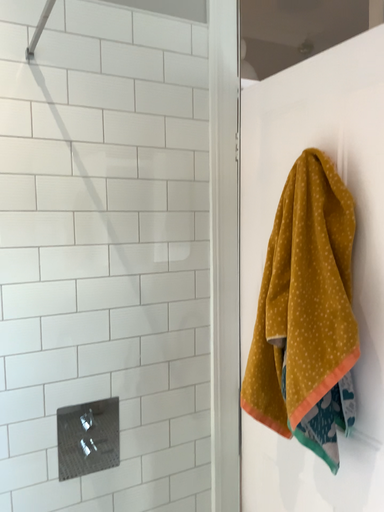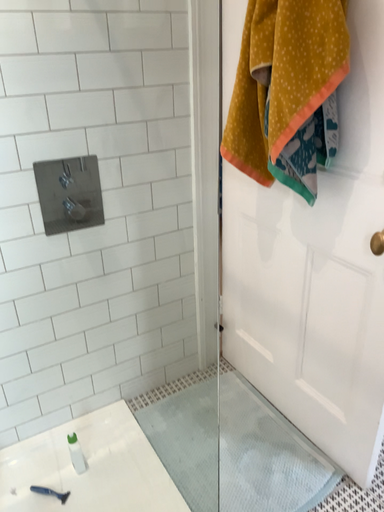
Question: Which way did the camera rotate in the video?

Choices:
 (A) rotated downward
 (B) rotated upward

Answer: (A)